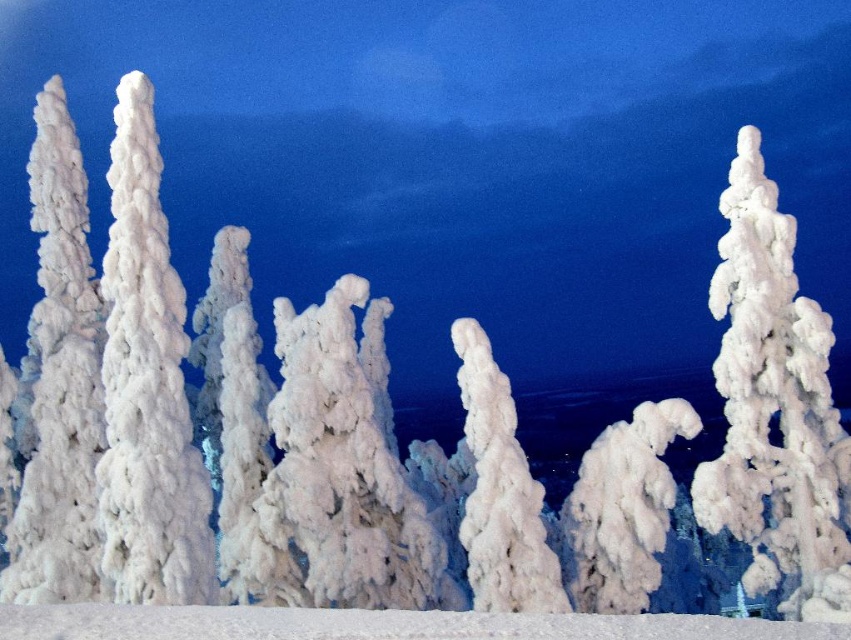
Question: Does frosted white tree at center appear over white fluffy tree at left?

Choices:
 (A) no
 (B) yes

Answer: (A)

Question: Which of the following is the farthest from the observer?

Choices:
 (A) white fluffy tree at left
 (B) white fluffy tree at center
 (C) frosted white tree at center

Answer: (A)

Question: Among these objects, which one is nearest to the camera?

Choices:
 (A) white fluffy tree at center
 (B) white fluffy tree at left

Answer: (A)

Question: Which point is closer to the camera?

Choices:
 (A) white fluffy tree at center
 (B) white fluffy snow at center

Answer: (B)

Question: Does white fluffy snow at center have a lesser width compared to white fluffy tree at center?

Choices:
 (A) no
 (B) yes

Answer: (A)

Question: Can you confirm if frosted white tree at center is thinner than white fluffy tree at center?

Choices:
 (A) yes
 (B) no

Answer: (B)